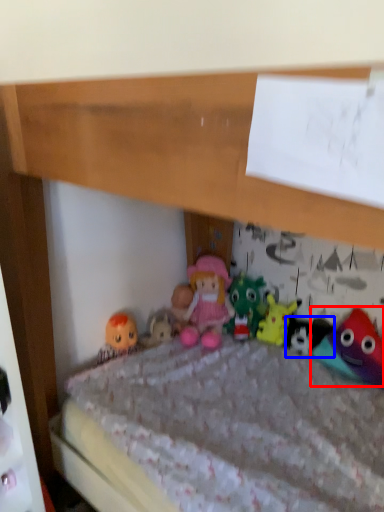
Question: Which object is further to the camera taking this photo, toy (highlighted by a red box) or toy (highlighted by a blue box)?

Choices:
 (A) toy
 (B) toy

Answer: (B)